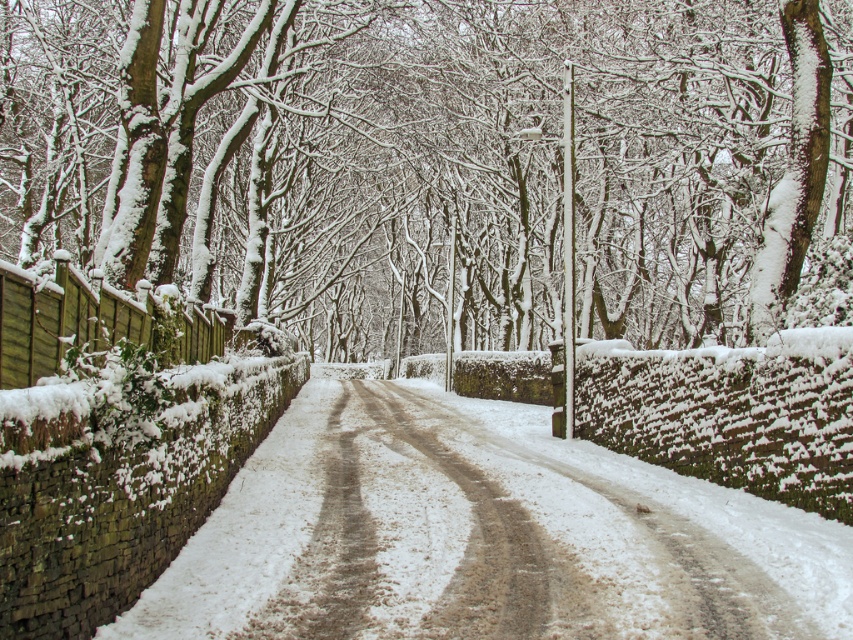
Question: Is snow-covered tree at center above brown textured dirt track at center?

Choices:
 (A) yes
 (B) no

Answer: (A)

Question: Is snow-covered tree at center to the left of brown textured dirt track at center from the viewer's perspective?

Choices:
 (A) no
 (B) yes

Answer: (B)

Question: Can you confirm if snow-covered tree at center is wider than brown textured dirt track at center?

Choices:
 (A) no
 (B) yes

Answer: (B)

Question: Which object is farther from the camera taking this photo?

Choices:
 (A) snow-covered tree at center
 (B) brown textured dirt track at center

Answer: (A)